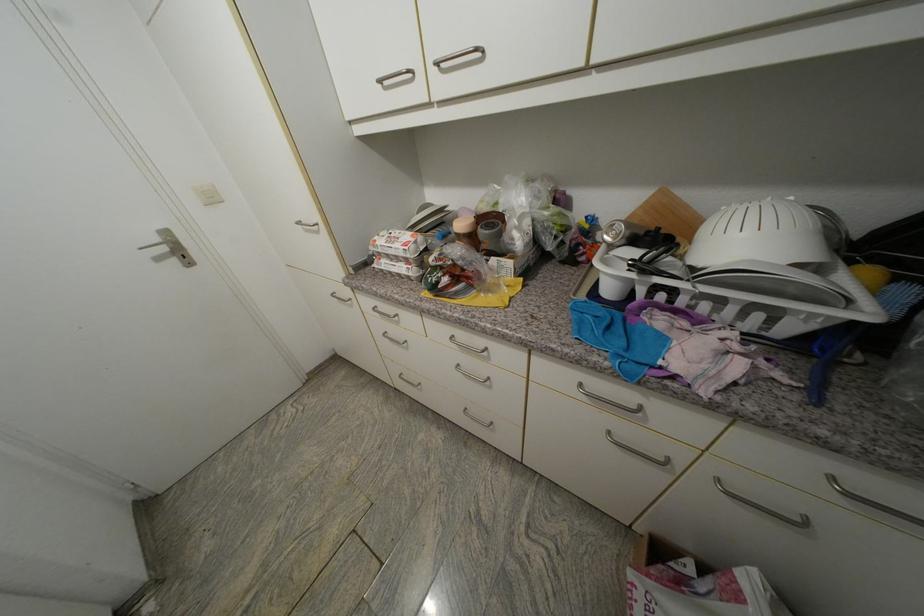
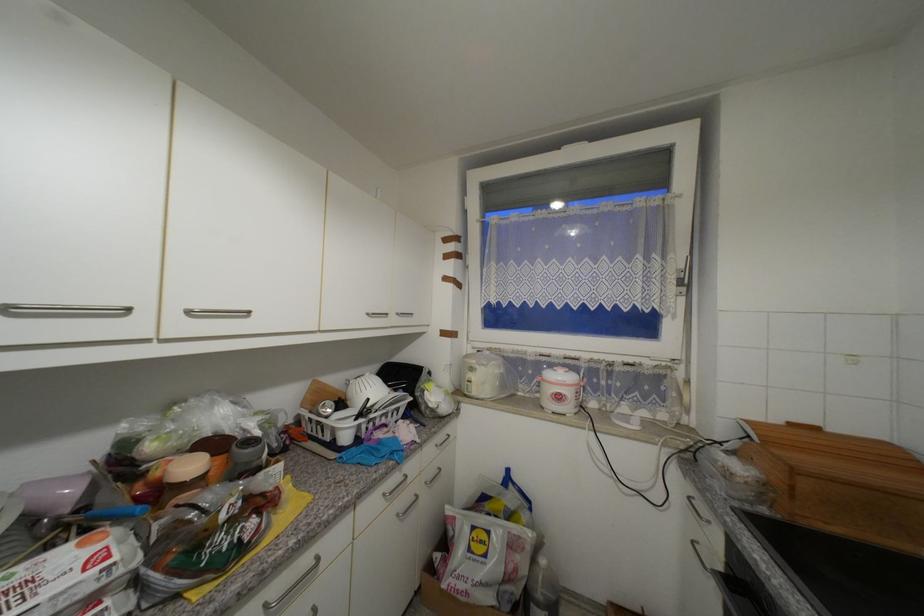
Question: Based on the continuous images, in which direction is the camera rotating? Reply with the corresponding letter.

Choices:
 (A) Left
 (B) Right
 (C) Up
 (D) Down

Answer: (B)